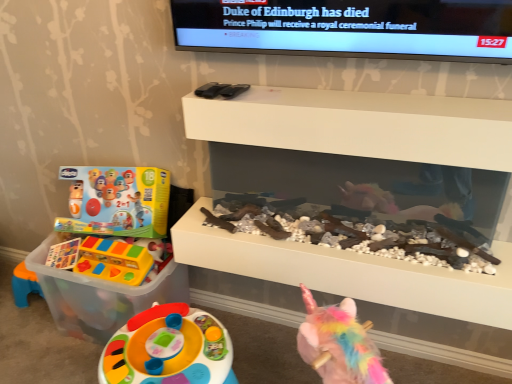
You are a GUI agent. You are given a task and a screenshot of the screen. Output one action in this format:
    pyautogui.click(x=<x>, y=<y>)
    Task: Click on the free spot above white matte shelf at upper center, positioned as the 2th shelf in bottom-to-top order (from a real-world perspective)
    
    Given the screenshot: What is the action you would take?
    pyautogui.click(x=348, y=96)